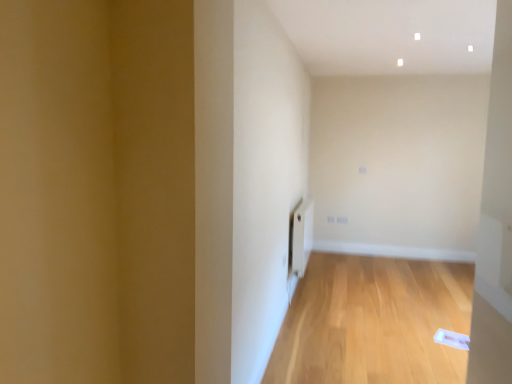
The image size is (512, 384). Describe the element at coordinates (373, 322) in the screenshot. I see `light wood floor at center` at that location.

The image size is (512, 384). In order to click on light wood floor at center in this screenshot , I will do `click(373, 322)`.

Find the location of `white matte radiator at center`. white matte radiator at center is located at coordinates (302, 237).

What do you see at coordinates (302, 237) in the screenshot? The height and width of the screenshot is (384, 512). I see `white matte radiator at center` at bounding box center [302, 237].

You are a GUI agent. You are given a task and a screenshot of the screen. Output one action in this format:
    pyautogui.click(x=<x>, y=<y>)
    Task: Click on the light wood floor at center
    The width and height of the screenshot is (512, 384).
    Given the screenshot: What is the action you would take?
    pyautogui.click(x=373, y=322)

Does white matte radiator at center appear on the left side of light wood floor at center?

Yes, white matte radiator at center is to the left of light wood floor at center.

Is white matte radiator at center closer to camera compared to light wood floor at center?

No, white matte radiator at center is further to the viewer.

Does point (298, 222) come in front of point (461, 270)?

Yes, it is.

Based on the photo, from the image's perspective, is white matte radiator at center over light wood floor at center?

Indeed, from the image's perspective, white matte radiator at center is shown above light wood floor at center.

From a real-world perspective, is white matte radiator at center physically below light wood floor at center?

No, from a real-world perspective, white matte radiator at center is not below light wood floor at center.

Between white matte radiator at center and light wood floor at center, which one has smaller width?

Thinner between the two is white matte radiator at center.

In the scene shown: Considering the relative sizes of white matte radiator at center and light wood floor at center in the image provided, is white matte radiator at center shorter than light wood floor at center?

No.

Considering the sizes of objects white matte radiator at center and light wood floor at center in the image provided, who is bigger, white matte radiator at center or light wood floor at center?

With larger size is light wood floor at center.

Is white matte radiator at center spatially inside light wood floor at center, or outside of it?

white matte radiator at center lies outside light wood floor at center.

Is white matte radiator at center in contact with light wood floor at center?

They are not placed beside each other.

Consider the image. Is light wood floor at center at the back of white matte radiator at center?

No, white matte radiator at center is not facing the opposite direction of light wood floor at center.

At what (x,y) coordinates should I click in order to perform the action: click on corridor on the right side of white matte radiator at center. Please return your answer as a coordinate pair (x, y). Looking at the image, I should click on (373, 322).

Based on the photo, considering the relative positions of light wood floor at center and white matte radiator at center in the image provided, is light wood floor at center to the right of white matte radiator at center from the viewer's perspective?

Yes, light wood floor at center is to the right of white matte radiator at center.

Which object is more forward, light wood floor at center or white matte radiator at center?

light wood floor at center is closer to the camera.

Which is behind, point (438, 382) or point (291, 240)?

The point (291, 240) is more distant.

From the image's perspective, does light wood floor at center appear higher than white matte radiator at center?

No, from the image's perspective, light wood floor at center is not over white matte radiator at center.

From a real-world perspective, is light wood floor at center on white matte radiator at center?

Actually, light wood floor at center is physically below white matte radiator at center in the real world.

Is light wood floor at center wider or thinner than white matte radiator at center?

light wood floor at center is wider than white matte radiator at center.

Does light wood floor at center have a lesser height compared to white matte radiator at center?

Yes, light wood floor at center is shorter than white matte radiator at center.

Looking at this image, who is smaller, light wood floor at center or white matte radiator at center?

white matte radiator at center.

Is light wood floor at center inside the boundaries of white matte radiator at center, or outside?

light wood floor at center lies outside white matte radiator at center.

Is light wood floor at center not close to white matte radiator at center?

Yes, light wood floor at center and white matte radiator at center are located far from each other.

Could you tell me if light wood floor at center is turned towards white matte radiator at center?

No, light wood floor at center is not oriented towards white matte radiator at center.

How different are the orientations of light wood floor at center and white matte radiator at center in degrees?

The facing directions of light wood floor at center and white matte radiator at center are 90.7 degrees apart.

The image size is (512, 384). What are the coordinates of `corridor that is in front of the white matte radiator at center` in the screenshot? It's located at (373, 322).

You are a GUI agent. You are given a task and a screenshot of the screen. Output one action in this format:
    pyautogui.click(x=<x>, y=<y>)
    Task: Click on the corridor that is below the white matte radiator at center (from the image's perspective)
    This screenshot has width=512, height=384.
    Given the screenshot: What is the action you would take?
    pyautogui.click(x=373, y=322)

I want to click on radiator that appears above the light wood floor at center (from a real-world perspective), so click(302, 237).